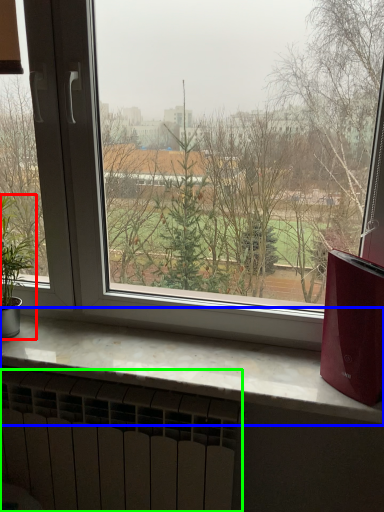
Question: Which object is positioned farthest from houseplant (highlighted by a red box)? Select from window sill (highlighted by a blue box) and radiator (highlighted by a green box).

Choices:
 (A) window sill
 (B) radiator

Answer: (B)